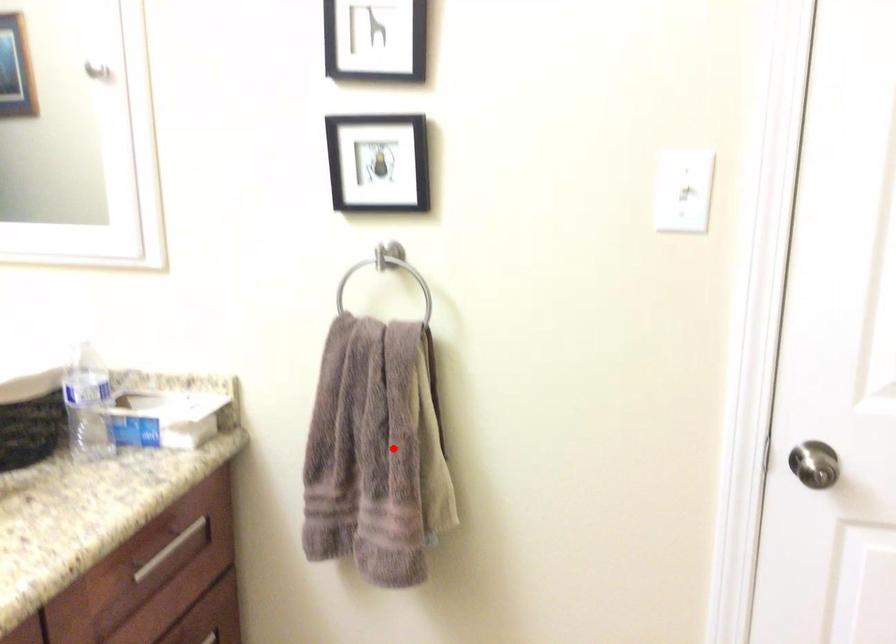
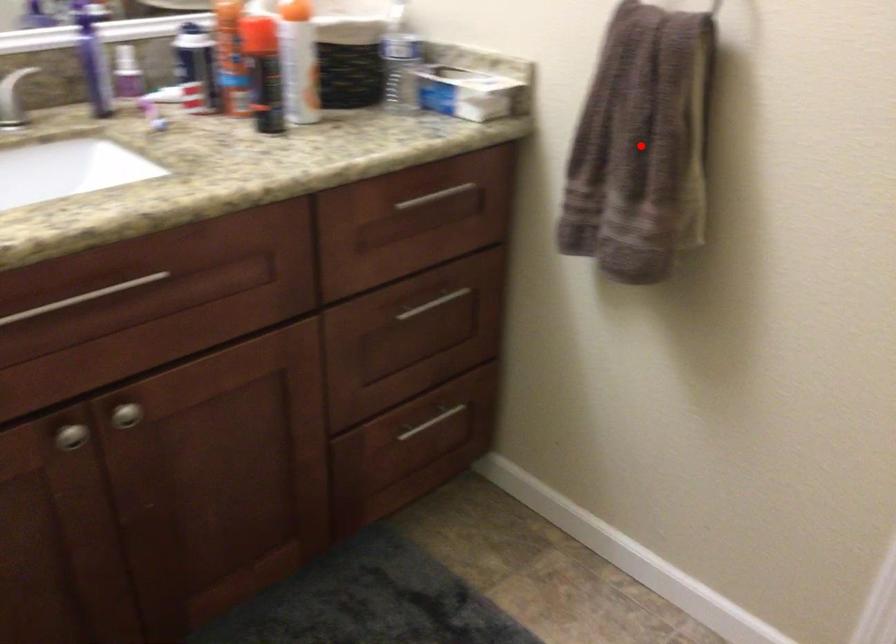
I am providing you with two images of the same scene from different viewpoints. A red point is marked on the first image and another point is marked on the second image. Are the points marked in image1 and image2 representing the same 3D position?

Yes